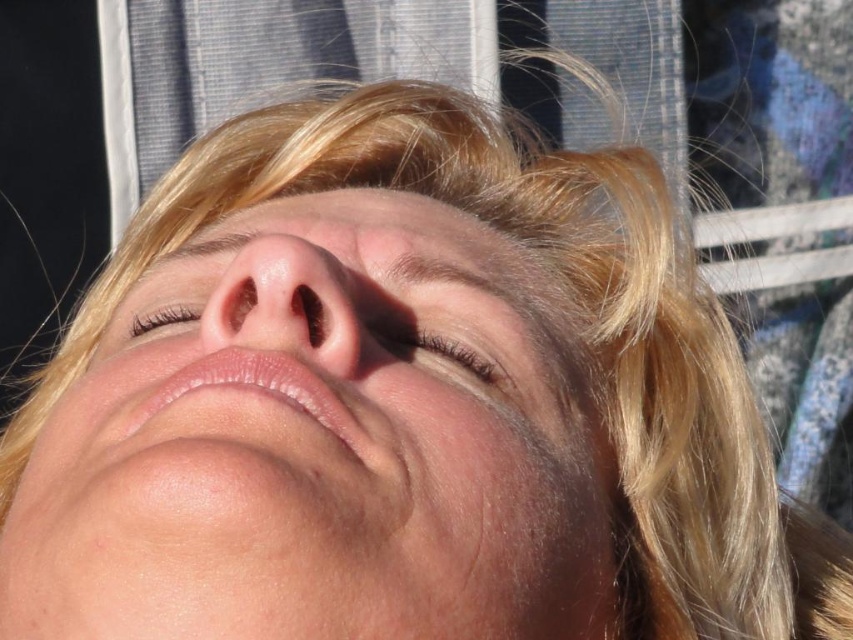
You are a makeup artist preparing to apply eyeliner on the brown matte eyelid at center. However, you notice the smooth skin face at center might interfere. Based on the scene, can you determine if the eyeliner application will be visible once applied?

The smooth skin face at center is in front of the brown matte eyelid at center, so the eyeliner applied on the brown matte eyelid at center will be partially or fully obscured by the smooth skin face at center, making it less visible.

You are an artist trying to draw the person in the image. You need to determine which of the two points, point (x=329, y=634) or point (x=152, y=328), should be shaded darker to create depth. Based on their positions, which point is closer to you?

Point (x=329, y=634) is closer to the viewer than point (x=152, y=328), so you should shade point (x=329, y=634) darker to create depth.